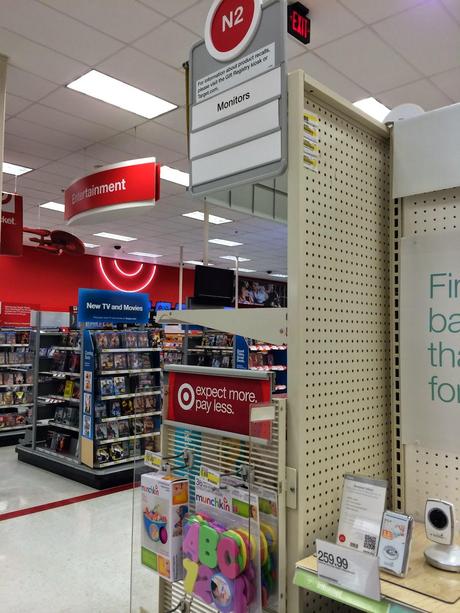
Locate an element on the screen. floor is located at coordinates (46, 560), (9, 471).